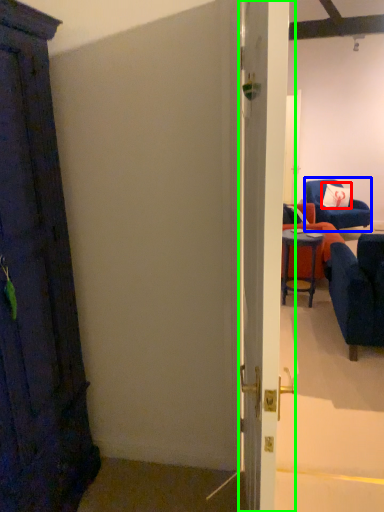
Question: Which is farther away from pillow (highlighted by a red box)? chair (highlighted by a blue box) or door (highlighted by a green box)?

Choices:
 (A) chair
 (B) door

Answer: (B)